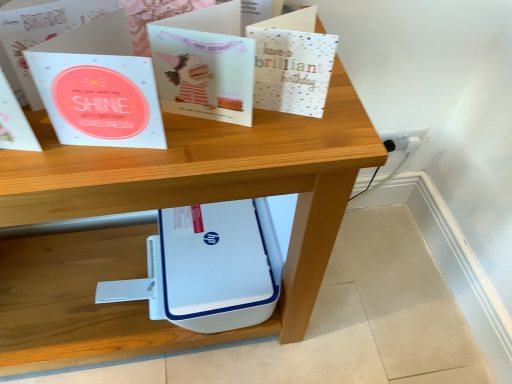
Where is `vacant area situated to the left side of metallic silver card at upper center, which is the third paperback book in left-to-right order`? This screenshot has width=512, height=384. vacant area situated to the left side of metallic silver card at upper center, which is the third paperback book in left-to-right order is located at coordinates (190, 139).